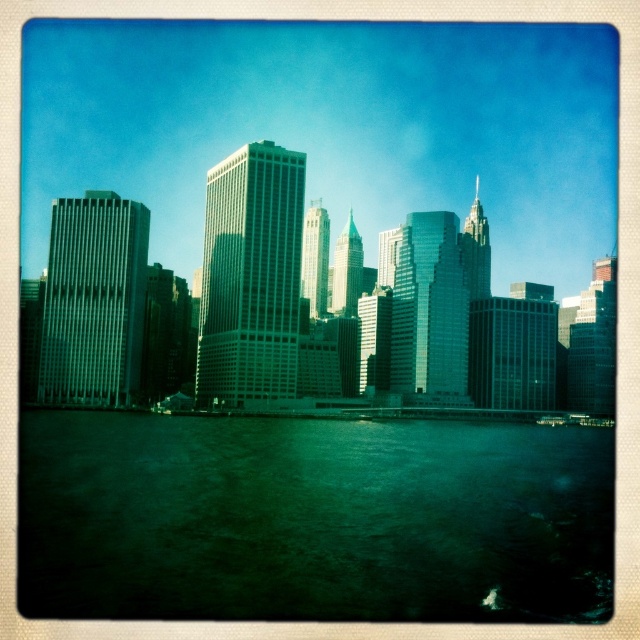
Looking at this image, you are standing at the edge of the water looking at the city skyline. There are two points marked in the image, one at coordinate point (442, 512) and another at point (412, 294). Which point is closer to you?

Point (442, 512) is closer to the viewer than point (412, 294) according to the description.

You are a photographer standing at the edge of the water in the scene. You want to capture a photo where both the green liquid water at lower center and the glassy skyscrapers at center are clearly visible. Given that your camera has a fixed focal length, which object should you frame closer to the center of the photo to ensure both are in focus?

Since the green liquid water at lower center is smaller in size compared to the glassy skyscrapers at center, you should frame the green liquid water at lower center closer to the center of the photo. This will help ensure both objects remain in focus given the camera constraints.